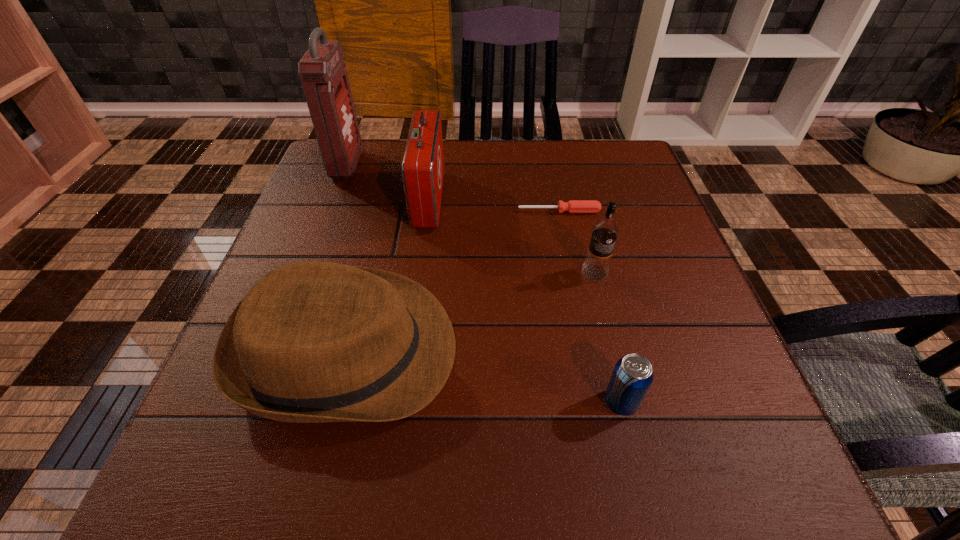
Find the location of a particular element. This screenshot has height=540, width=960. vacant area between the beer can and the fourth tallest object is located at coordinates (484, 376).

You are a GUI agent. You are given a task and a screenshot of the screen. Output one action in this format:
    pyautogui.click(x=<x>, y=<y>)
    Task: Click on the vacant point located between the shorter first-aid kit and the fifth tallest object
    This screenshot has width=960, height=540.
    Given the screenshot: What is the action you would take?
    pos(525,301)

The image size is (960, 540). In order to click on vacant point located between the fifth shortest object and the third nearest object in this screenshot , I will do `click(512, 237)`.

The image size is (960, 540). In order to click on vacant area that lies between the tallest object and the screwdriver in this screenshot , I will do `click(453, 188)`.

In order to click on vacant point located between the taller first-aid kit and the fourth farthest object in this screenshot , I will do `click(471, 219)`.

Select which object is the second closest to the vodka. Please provide its 2D coordinates. Your answer should be formatted as a tuple, i.e. [(x, y)], where the tuple contains the x and y coordinates of a point satisfying the conditions above.

[(633, 375)]

Where is `object that is the second closest to the vodka`? The image size is (960, 540). object that is the second closest to the vodka is located at coordinates (633, 375).

At what (x,y) coordinates should I click in order to perform the action: click on vacant space that satisfies the following two spatial constraints: 1. on the back side of the shortest object; 2. on the side of the shorter first-aid kit with the first aid cross symbol. Please return your answer as a coordinate pair (x, y). The image size is (960, 540). Looking at the image, I should click on (557, 200).

The width and height of the screenshot is (960, 540). What are the coordinates of `vacant space that satisfies the following two spatial constraints: 1. on the side of the beer can with the first aid cross symbol; 2. on the right side of the fifth shortest object` in the screenshot? It's located at (401, 402).

You are a GUI agent. You are given a task and a screenshot of the screen. Output one action in this format:
    pyautogui.click(x=<x>, y=<y>)
    Task: Click on the free spot that satisfies the following two spatial constraints: 1. on the front-facing side of the shortest object; 2. on the left side of the left first-aid kit
    Image resolution: width=960 pixels, height=540 pixels.
    Given the screenshot: What is the action you would take?
    click(x=329, y=211)